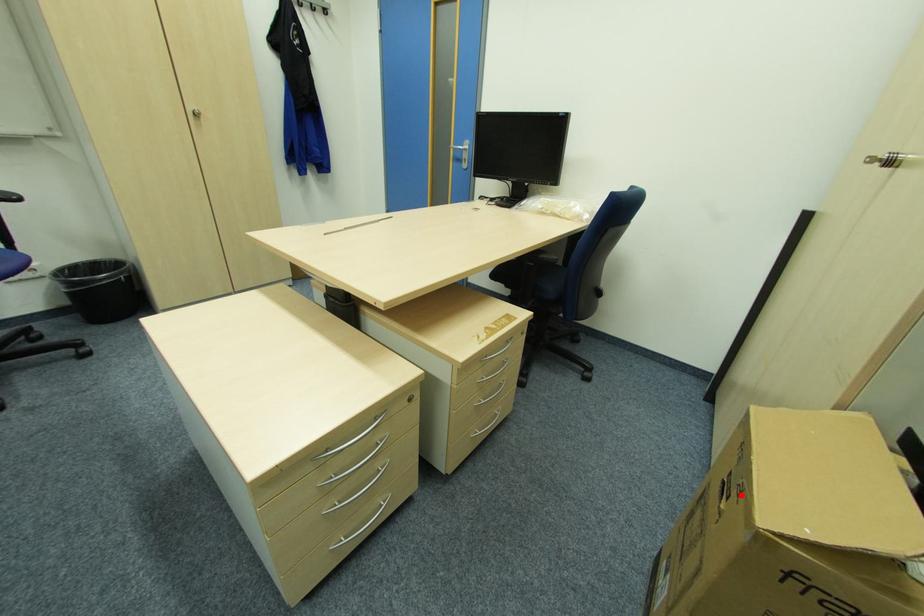
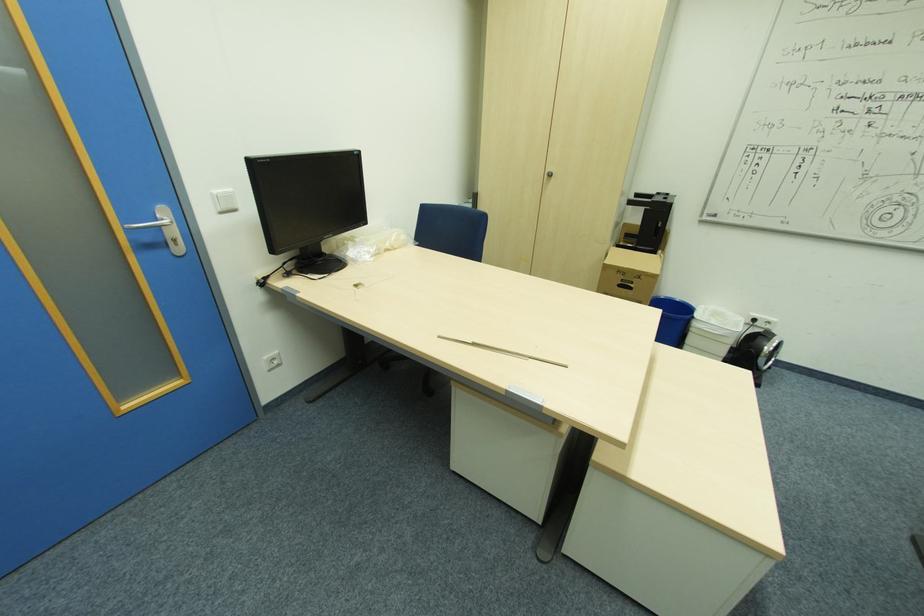
Question: I am providing you with two images of the same scene from different viewpoints. Image1 has a red point marked. In image2, the corresponding 3D location appears at what relative position? Reply with the corresponding letter.

Choices:
 (A) Closer
 (B) Farther

Answer: (A)